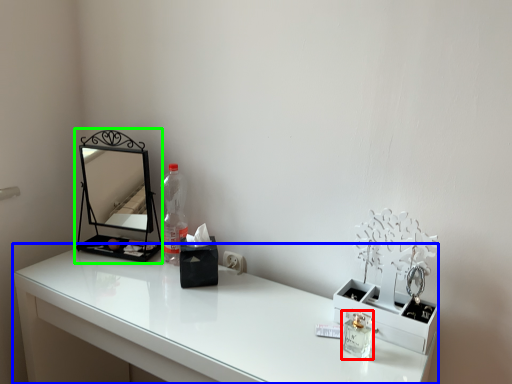
Question: Which object is the closest to the perfume (highlighted by a red box)? Choose among these: table (highlighted by a blue box) or medicine cabinet (highlighted by a green box).

Choices:
 (A) table
 (B) medicine cabinet

Answer: (A)